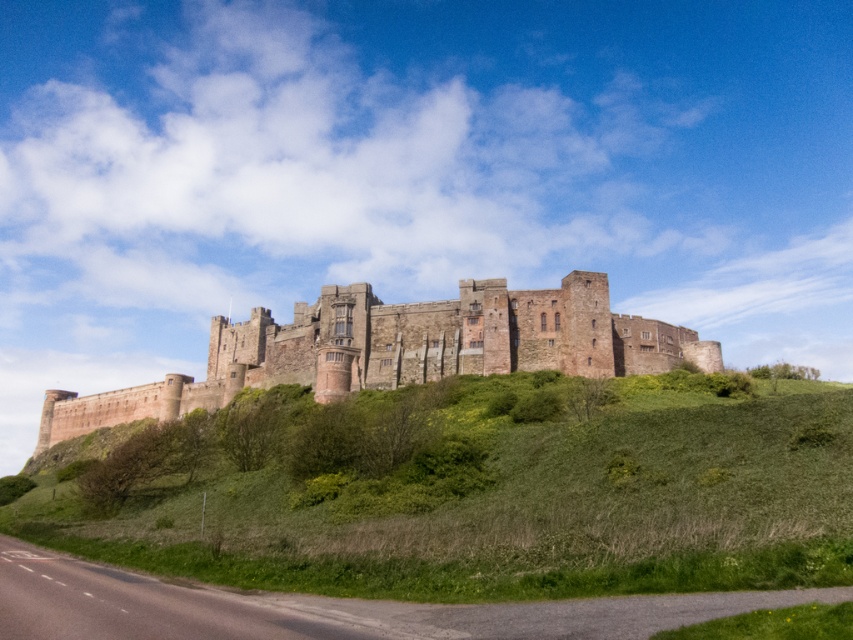
Question: Does green grassy hillside at center have a larger size compared to brown stone castle at center?

Choices:
 (A) yes
 (B) no

Answer: (B)

Question: Does green grassy hillside at center come in front of brown stone castle at center?

Choices:
 (A) no
 (B) yes

Answer: (B)

Question: Which point is closer to the camera taking this photo?

Choices:
 (A) click(392, 364)
 (B) click(704, 493)

Answer: (B)

Question: Is green grassy hillside at center below brown stone castle at center?

Choices:
 (A) no
 (B) yes

Answer: (B)

Question: Which point is closer to the camera?

Choices:
 (A) green grassy hillside at center
 (B) brown stone castle at center

Answer: (A)